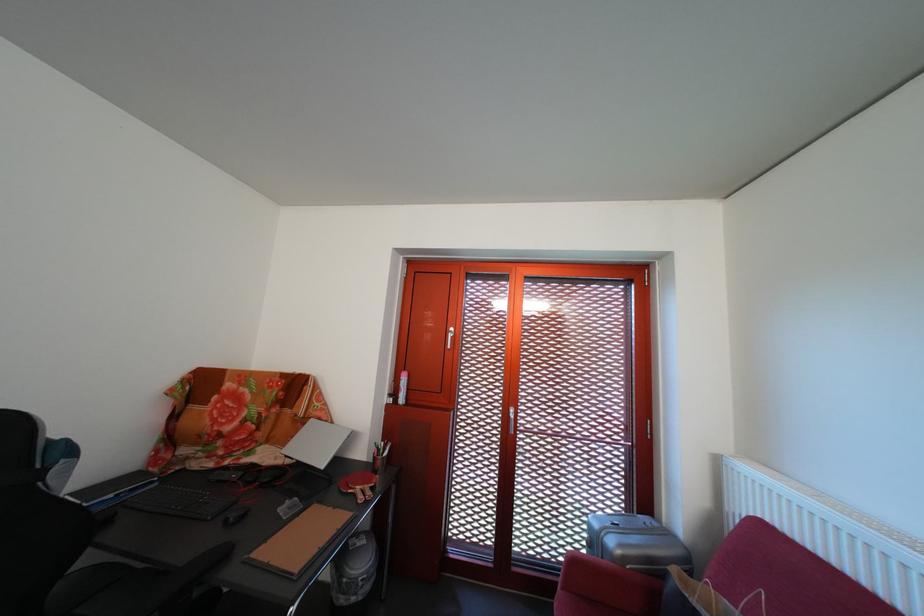
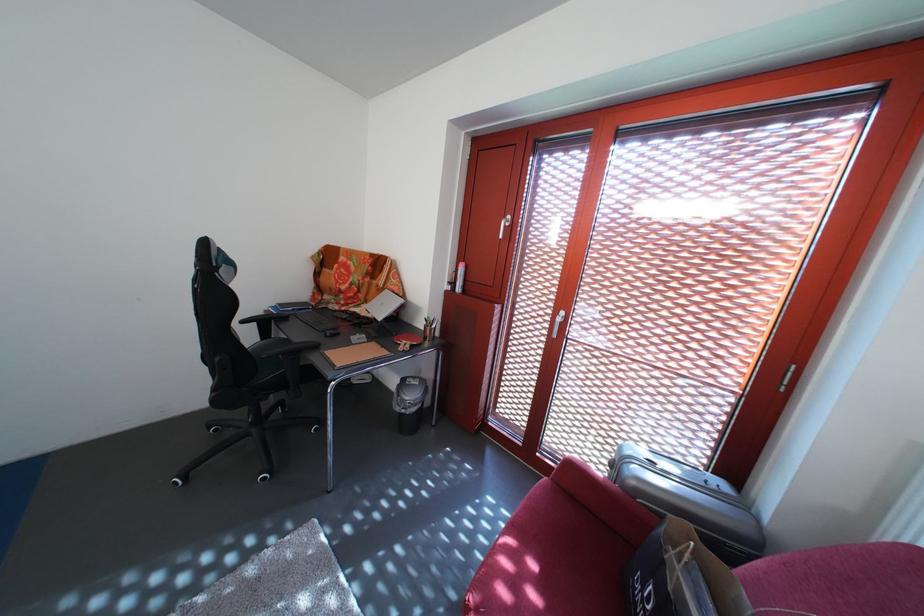
The first image is from the beginning of the video and the second image is from the end. How did the camera likely rotate when shooting the video?

The rotation direction of the camera is left-down.